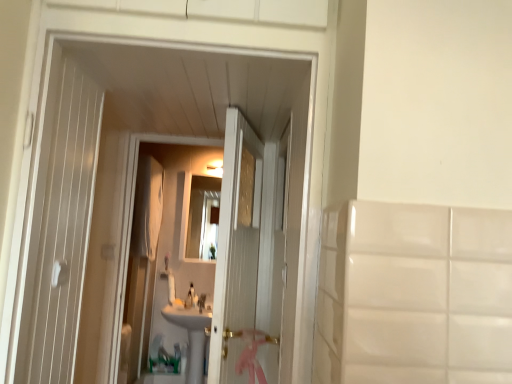
Question: Does white glossy mirror at center lie in front of white glossy soap at center?

Choices:
 (A) yes
 (B) no

Answer: (B)

Question: Is white glossy mirror at center oriented towards white glossy soap at center?

Choices:
 (A) no
 (B) yes

Answer: (A)

Question: Is white glossy mirror at center next to white glossy soap at center and touching it?

Choices:
 (A) no
 (B) yes

Answer: (A)

Question: Is white glossy mirror at center smaller than white glossy soap at center?

Choices:
 (A) yes
 (B) no

Answer: (B)

Question: Does white glossy mirror at center appear on the right side of white glossy soap at center?

Choices:
 (A) yes
 (B) no

Answer: (A)

Question: Can you confirm if white glossy mirror at center is thinner than white glossy soap at center?

Choices:
 (A) no
 (B) yes

Answer: (B)

Question: From the image's perspective, is white glossy soap at center located beneath white glossy faucet at center, marked as the first faucet in a left-to-right arrangement?

Choices:
 (A) yes
 (B) no

Answer: (A)

Question: Are white glossy soap at center and white glossy faucet at center, which is the second faucet in right-to-left order, making contact?

Choices:
 (A) no
 (B) yes

Answer: (A)

Question: Can you confirm if white glossy soap at center is smaller than white glossy faucet at center, which is the second faucet in right-to-left order?

Choices:
 (A) no
 (B) yes

Answer: (B)

Question: Is white glossy soap at center not within white glossy faucet at center, which is the second faucet in right-to-left order?

Choices:
 (A) no
 (B) yes

Answer: (B)

Question: Can you confirm if white glossy soap at center is shorter than white glossy faucet at center, which is the second faucet in right-to-left order?

Choices:
 (A) no
 (B) yes

Answer: (B)

Question: Considering the relative sizes of white glossy soap at center and white glossy faucet at center, marked as the first faucet in a left-to-right arrangement, in the image provided, is white glossy soap at center taller than white glossy faucet at center, marked as the first faucet in a left-to-right arrangement,?

Choices:
 (A) yes
 (B) no

Answer: (B)

Question: Does white glossy sink at center have a smaller size compared to white glossy mirror at center?

Choices:
 (A) no
 (B) yes

Answer: (A)